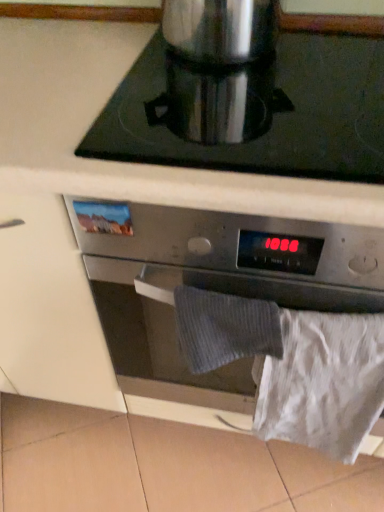
Question: Does point (213, 28) appear closer or farther from the camera than point (274, 82)?

Choices:
 (A) closer
 (B) farther

Answer: (A)

Question: From a real-world perspective, is satin silver coffee pot at upper center physically located above or below silver metallic pot at upper center?

Choices:
 (A) below
 (B) above

Answer: (B)

Question: Based on their relative distances, which object is farther from the satin silver coffee pot at upper center?

Choices:
 (A) satin silver oven at center
 (B) white paper at lower right
 (C) silver metallic pot at upper center

Answer: (B)

Question: Estimate the real-world distances between objects in this image. Which object is farther from the white paper at lower right?

Choices:
 (A) silver metallic pot at upper center
 (B) satin silver coffee pot at upper center
 (C) satin silver oven at center

Answer: (B)